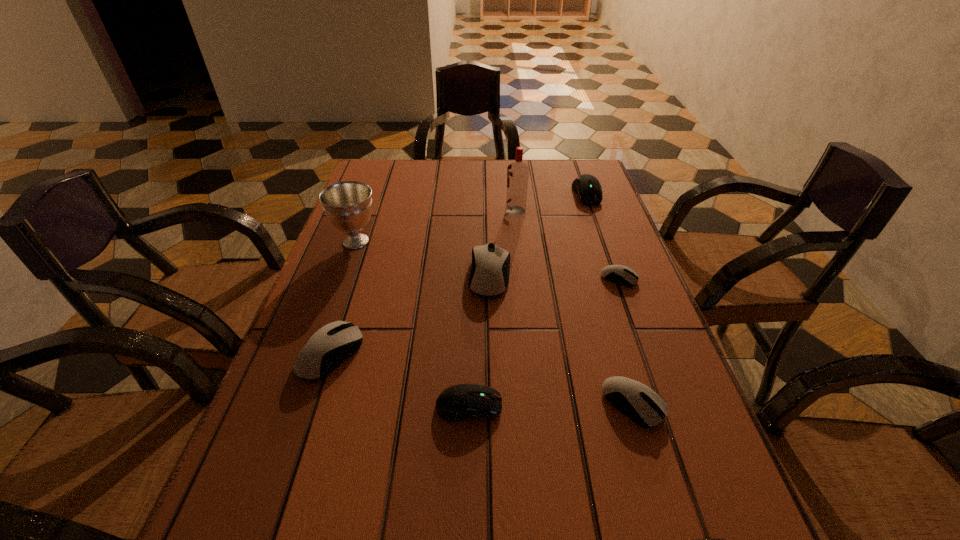
Locate an element on the screen. The width and height of the screenshot is (960, 540). red vodka is located at coordinates (517, 172).

In order to click on the tallest object in this screenshot , I will do `click(517, 172)`.

The height and width of the screenshot is (540, 960). Identify the location of chalice. (348, 205).

Find the location of a particular element. This screenshot has height=540, width=960. the tallest computer equipment is located at coordinates (489, 276).

I want to click on the third tallest object, so click(489, 276).

Locate an element on the screen. the leftmost white mouse is located at coordinates (333, 343).

Where is `the third smallest white mouse`? The width and height of the screenshot is (960, 540). the third smallest white mouse is located at coordinates (333, 343).

The width and height of the screenshot is (960, 540). In order to click on the farthest computer equipment in this screenshot , I will do `click(587, 187)`.

Where is `the farthest dark computer equipment`? the farthest dark computer equipment is located at coordinates (587, 187).

Where is `the third biggest white mouse`? This screenshot has width=960, height=540. the third biggest white mouse is located at coordinates (643, 405).